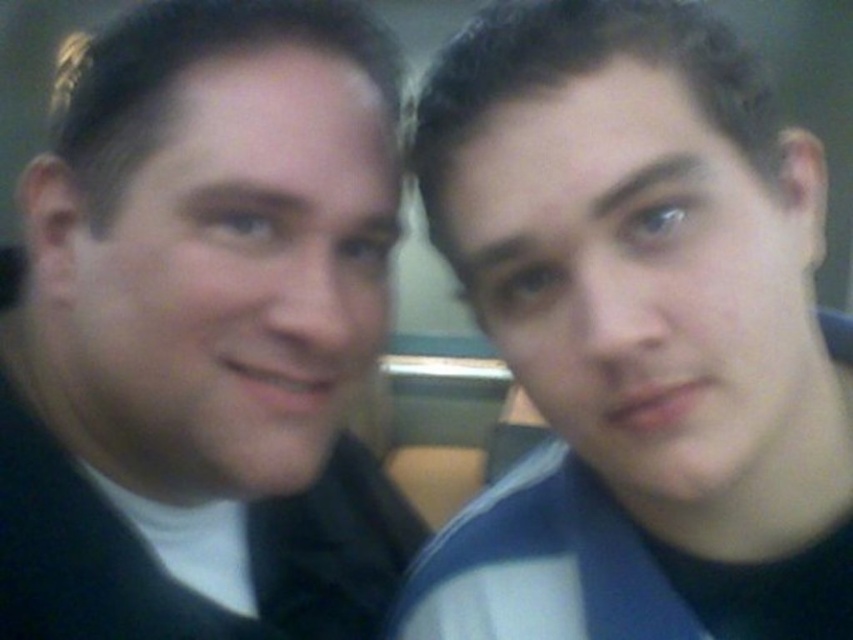
Does black matte suit at left appear over blue striped shirt at right?

Yes, black matte suit at left is above blue striped shirt at right.

Between black matte suit at left and blue striped shirt at right, which one appears on the right side from the viewer's perspective?

blue striped shirt at right is more to the right.

Who is more distant from viewer, [332,388] or [625,228]?

Point [332,388]

What are the coordinates of `black matte suit at left` in the screenshot? It's located at (204, 332).